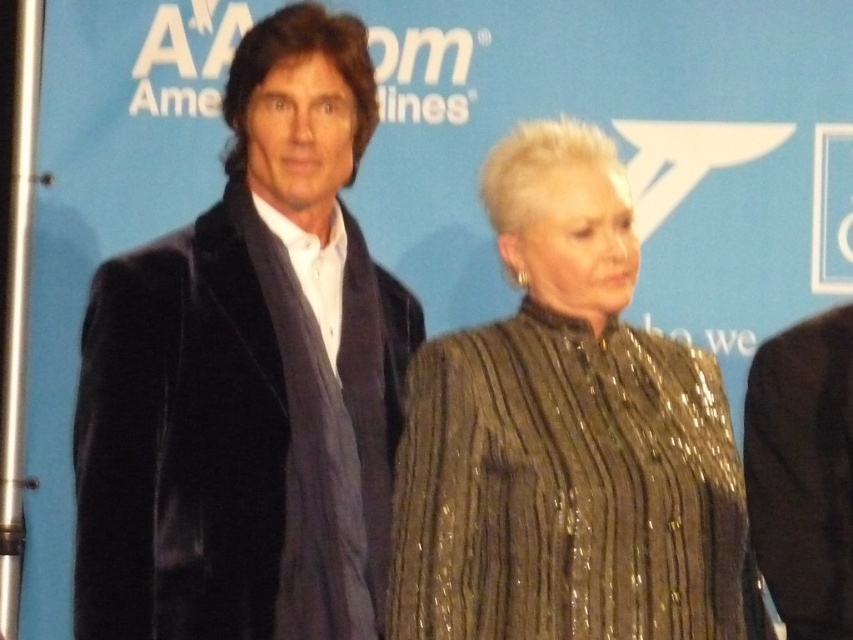
Who is more distant from viewer, (280, 161) or (842, 577)?

Point (280, 161)

Is point (337, 275) closer to camera compared to point (825, 340)?

No, (337, 275) is further to viewer.

Identify the location of velvet black coat at left. 248,378.

Where is `shiny sequined dress at center`? Image resolution: width=853 pixels, height=640 pixels. shiny sequined dress at center is located at coordinates click(x=567, y=436).

Which of these two, shiny sequined dress at center or black velvet suit at right, stands shorter?

With less height is black velvet suit at right.

The height and width of the screenshot is (640, 853). What do you see at coordinates (567, 436) in the screenshot?
I see `shiny sequined dress at center` at bounding box center [567, 436].

You are a GUI agent. You are given a task and a screenshot of the screen. Output one action in this format:
    pyautogui.click(x=<x>, y=<y>)
    Task: Click on the shiny sequined dress at center
    
    Given the screenshot: What is the action you would take?
    pyautogui.click(x=567, y=436)

Which is above, velvet black coat at left or shiny sequined dress at center?

velvet black coat at left is higher up.

What do you see at coordinates (248, 378) in the screenshot? This screenshot has height=640, width=853. I see `velvet black coat at left` at bounding box center [248, 378].

In order to click on velvet black coat at left in this screenshot , I will do click(x=248, y=378).